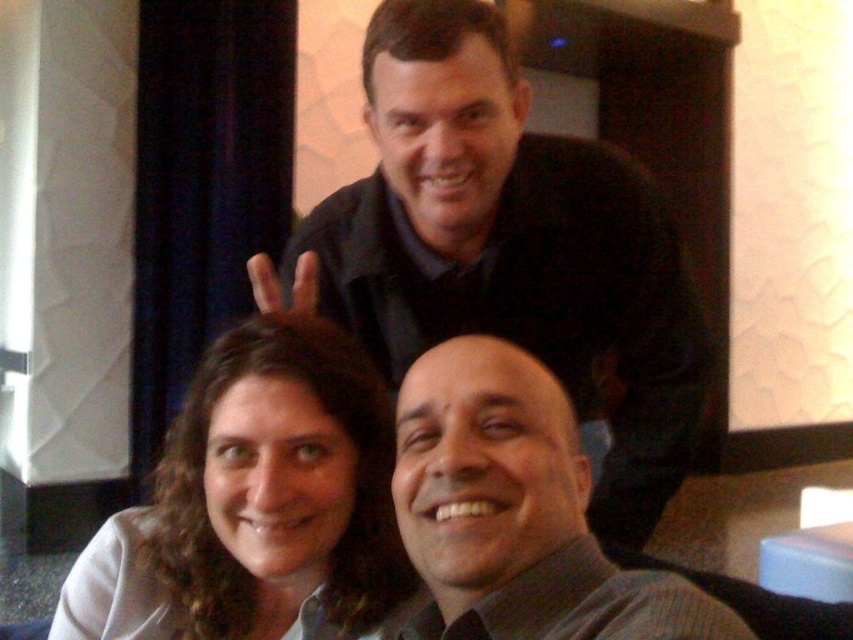
Does point (326, 316) come behind point (258, 276)?

That is True.

Is point (614, 301) positioned in front of point (300, 260)?

No, it is behind (300, 260).

Where is `matte black jacket at upper center`? This screenshot has height=640, width=853. matte black jacket at upper center is located at coordinates (512, 248).

Can you confirm if curly brown hair at lower left is smaller than matte black hand at upper center?

No, curly brown hair at lower left is not smaller than matte black hand at upper center.

Does curly brown hair at lower left have a larger size compared to matte black hand at upper center?

Correct, curly brown hair at lower left is larger in size than matte black hand at upper center.

What are the coordinates of `curly brown hair at lower left` in the screenshot? It's located at (254, 500).

Image resolution: width=853 pixels, height=640 pixels. In order to click on curly brown hair at lower left in this screenshot , I will do [254, 500].

Does curly brown hair at lower left have a smaller size compared to matte gray shirt at center?

No, curly brown hair at lower left is not smaller than matte gray shirt at center.

Based on the photo, is curly brown hair at lower left to the left of matte gray shirt at center from the viewer's perspective?

Correct, you'll find curly brown hair at lower left to the left of matte gray shirt at center.

I want to click on curly brown hair at lower left, so click(x=254, y=500).